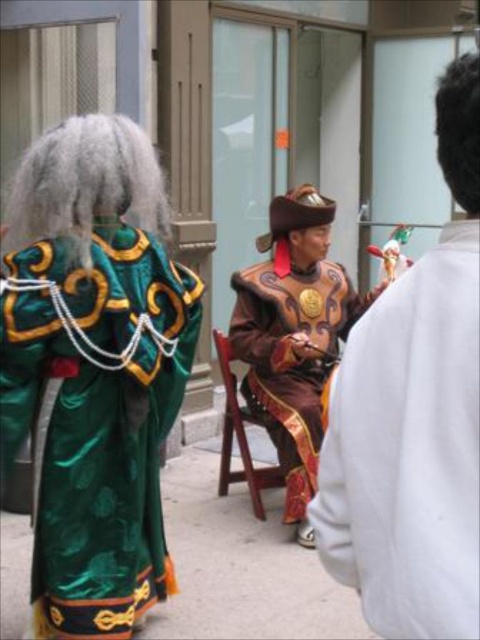
You are attending a cultural event and see the brown satin costume at center and the wooden at center. Which one is positioned to the right in the scene?

The brown satin costume at center is positioned to the right of the wooden at center.

You are an event planner setting up a photo shoot for the cultural event. You need to position a camera so that both the shiny brown leather hat at center and the wooden at center are visible in the frame. Considering their heights, which object should be placed closer to the camera to ensure both are fully visible?

The shiny brown leather hat at center is shorter than the wooden at center. To ensure both are fully visible, the wooden at center should be placed closer to the camera so its height doesn

You are a photographer trying to capture both the shiny brown leather hat at center and the wooden at center in a single frame. Given that your camera can only focus on objects wider than 10 cm, which object might require you to adjust your focus settings?

The shiny brown leather hat at center has a smaller width than the wooden at center, so it might require adjusting focus settings since it is narrower than 10 cm if the wooden object meets or exceeds the required width.